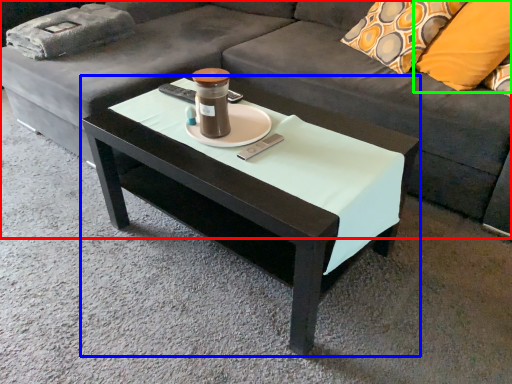
Question: Which is farther away from studio couch (highlighted by a red box)? coffee table (highlighted by a blue box) or pillow (highlighted by a green box)?

Choices:
 (A) coffee table
 (B) pillow

Answer: (B)